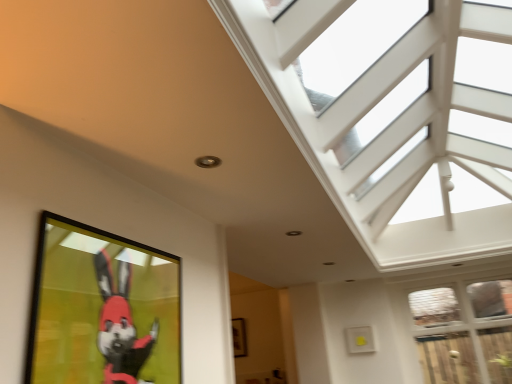
Question: From a real-world perspective, is matte black picture frame at lower left, placed as the 2th picture frame when sorted from back to front, over white textured glass at upper right, the second window positioned from the bottom?

Choices:
 (A) yes
 (B) no

Answer: (B)

Question: Is matte black picture frame at lower left, placed as the 1th picture frame when sorted from front to back, outside white textured glass at upper right, which ranks as the 1th window in top-to-bottom order?

Choices:
 (A) no
 (B) yes

Answer: (B)

Question: Can you confirm if matte black picture frame at lower left, positioned as the 2th picture frame in bottom-to-top order, is thinner than white textured glass at upper right, which ranks as the 1th window in top-to-bottom order?

Choices:
 (A) yes
 (B) no

Answer: (A)

Question: Can you confirm if matte black picture frame at lower left, the first picture frame from the top, is bigger than white textured glass at upper right, which ranks as the 1th window in top-to-bottom order?

Choices:
 (A) no
 (B) yes

Answer: (A)

Question: Is matte black picture frame at lower left, the first picture frame from the top, at the right side of white textured glass at upper right, which ranks as the 1th window in top-to-bottom order?

Choices:
 (A) yes
 (B) no

Answer: (B)

Question: Is matte black picture frame at lower left, placed as the 2th picture frame when sorted from back to front, positioned behind white textured glass at upper right, which ranks as the 1th window in top-to-bottom order?

Choices:
 (A) yes
 (B) no

Answer: (A)

Question: From the image's perspective, is white textured glass at upper right, the second window positioned from the bottom, under wooden picture frame at center, marked as the second picture frame in a top-to-bottom arrangement?

Choices:
 (A) yes
 (B) no

Answer: (B)

Question: Is white textured glass at upper right, the second window positioned from the bottom, taller than wooden picture frame at center, the 1th picture frame positioned from the back?

Choices:
 (A) yes
 (B) no

Answer: (A)

Question: Considering the relative sizes of white textured glass at upper right, the second window positioned from the bottom, and wooden picture frame at center, arranged as the 1th picture frame when ordered from the bottom, in the image provided, is white textured glass at upper right, the second window positioned from the bottom, thinner than wooden picture frame at center, arranged as the 1th picture frame when ordered from the bottom,?

Choices:
 (A) yes
 (B) no

Answer: (B)

Question: Considering the relative positions of white textured glass at upper right, the second window positioned from the bottom, and wooden picture frame at center, marked as the second picture frame in a top-to-bottom arrangement, in the image provided, is white textured glass at upper right, the second window positioned from the bottom, to the right of wooden picture frame at center, marked as the second picture frame in a top-to-bottom arrangement, from the viewer's perspective?

Choices:
 (A) yes
 (B) no

Answer: (A)

Question: Would you say wooden picture frame at center, arranged as the 1th picture frame when ordered from the bottom, is part of white textured glass at upper right, the second window positioned from the bottom,'s contents?

Choices:
 (A) yes
 (B) no

Answer: (B)

Question: Can you confirm if white textured glass at upper right, the second window positioned from the bottom, is positioned to the left of wooden picture frame at center, which is counted as the second picture frame, starting from the front?

Choices:
 (A) no
 (B) yes

Answer: (A)

Question: From the image's perspective, would you say clear glass door at lower right, the first window in the bottom-to-top sequence, is shown under white textured glass at upper right, which ranks as the 1th window in top-to-bottom order?

Choices:
 (A) no
 (B) yes

Answer: (B)